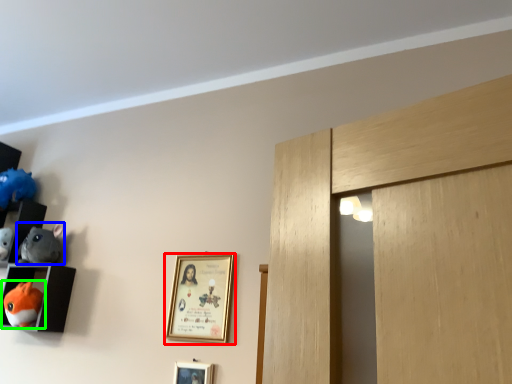
Question: Which object is the farthest from picture frame (highlighted by a red box)? Choose among these: toy (highlighted by a blue box) or toy (highlighted by a green box).

Choices:
 (A) toy
 (B) toy

Answer: (A)